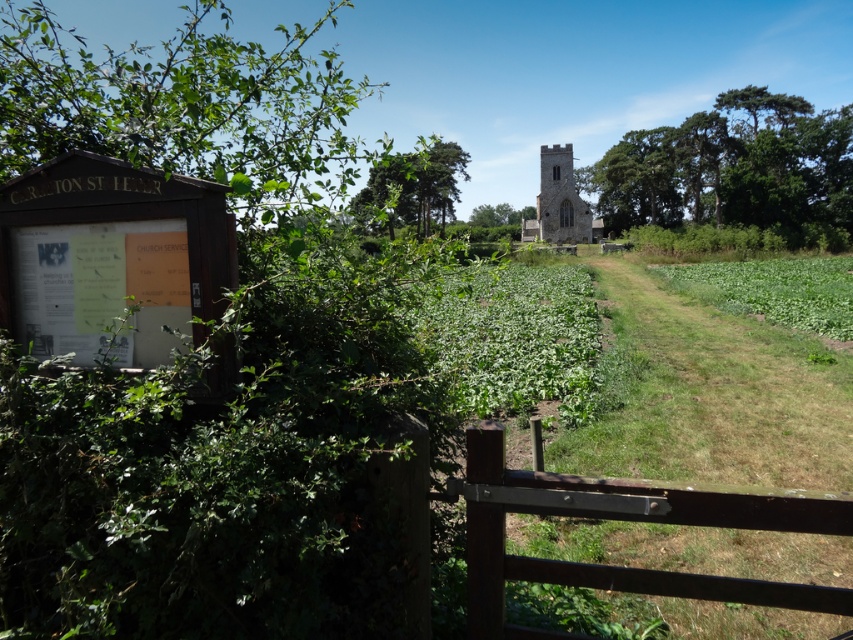
Question: Which of the following is the closest to the observer?

Choices:
 (A) stone tower at center
 (B) green leafy tree at center
 (C) brown wooden gate at lower center

Answer: (C)

Question: Based on their relative distances, which object is farther from the brown wooden gate at lower center?

Choices:
 (A) stone tower at center
 (B) green leafy tree at center
 (C) green leafy tree at upper right

Answer: (C)

Question: Can you confirm if brown wooden gate at lower center is smaller than green leafy tree at center?

Choices:
 (A) yes
 (B) no

Answer: (A)

Question: Is green leafy tree at upper right to the right of stone tower at center from the viewer's perspective?

Choices:
 (A) no
 (B) yes

Answer: (B)

Question: Is brown wooden gate at lower center above green leafy tree at upper right?

Choices:
 (A) yes
 (B) no

Answer: (B)

Question: Which object is positioned farthest from the green leafy tree at upper right?

Choices:
 (A) green leafy tree at center
 (B) stone tower at center

Answer: (A)